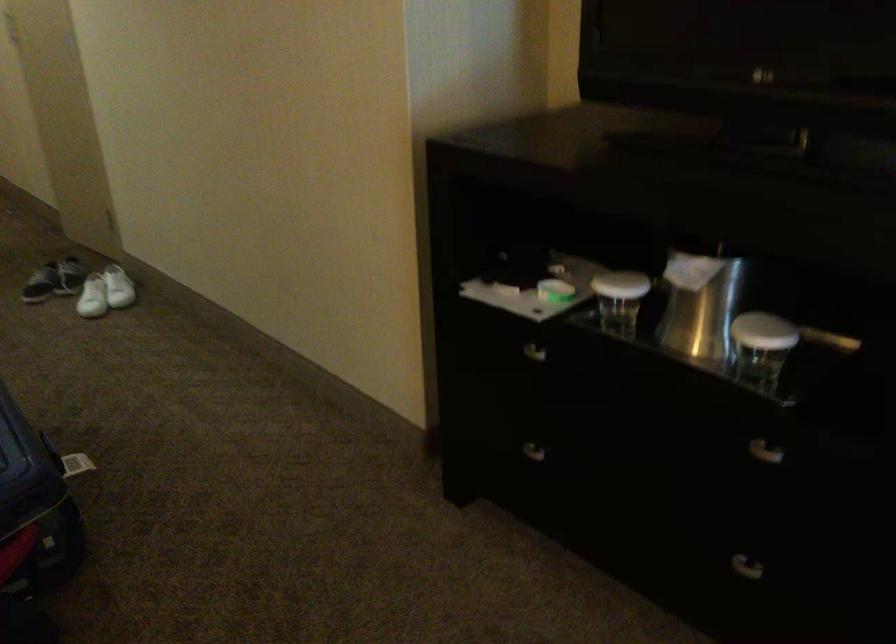
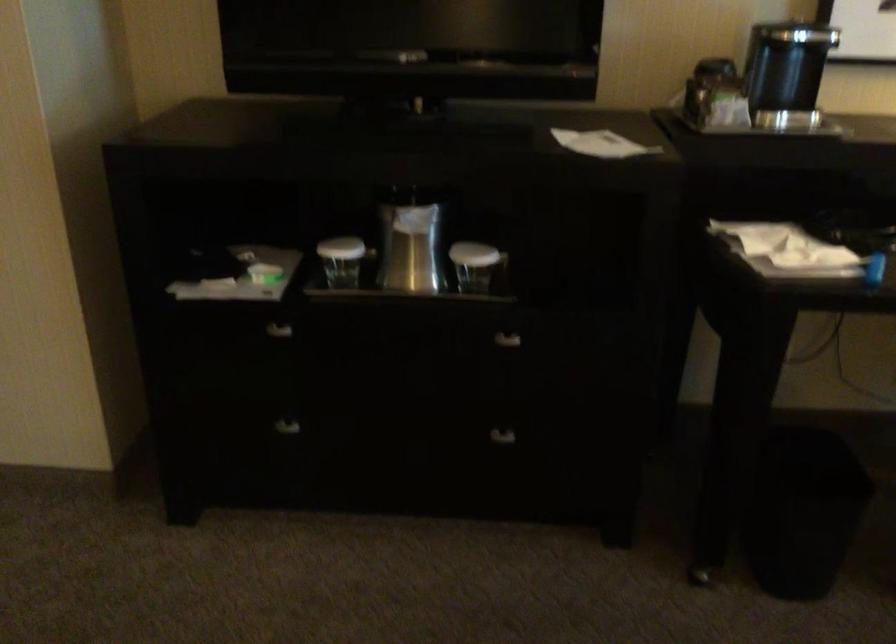
Where in the second image is the point corresponding to point 621,297 from the first image?

(341, 261)